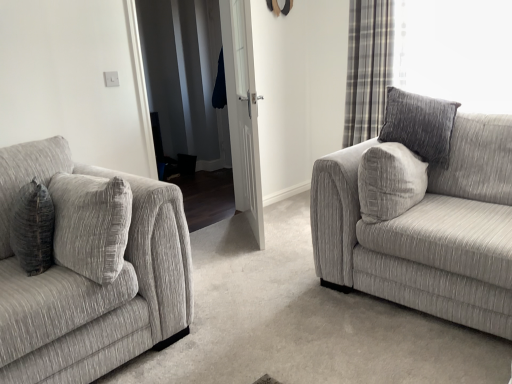
What do you see at coordinates (243, 111) in the screenshot?
I see `white glossy door at center` at bounding box center [243, 111].

Identify the location of plaid fabric curtain at upper right. The width and height of the screenshot is (512, 384). (367, 68).

The height and width of the screenshot is (384, 512). I want to click on textured gray couch at left, which is counted as the first studio couch, starting from the left, so click(x=90, y=269).

Is plaid fabric curtain at upper right taller or shorter than textured gray couch at right, which is counted as the first studio couch, starting from the right?

Clearly, plaid fabric curtain at upper right is taller compared to textured gray couch at right, which is counted as the first studio couch, starting from the right.

Is plaid fabric curtain at upper right smaller than textured gray couch at right, marked as the 2th studio couch in a left-to-right arrangement?

Yes, plaid fabric curtain at upper right is smaller than textured gray couch at right, marked as the 2th studio couch in a left-to-right arrangement.

From a real-world perspective, is plaid fabric curtain at upper right positioned under textured gray couch at right, marked as the 2th studio couch in a left-to-right arrangement, based on gravity?

No.

How many degrees apart are the facing directions of plaid fabric curtain at upper right and textured gray couch at right, marked as the 2th studio couch in a left-to-right arrangement?

They differ by 4.1 degrees in their facing directions.

Considering the relative positions of textured gray couch at left, acting as the 2th studio couch starting from the right, and white glossy door at center in the image provided, is textured gray couch at left, acting as the 2th studio couch starting from the right, to the right of white glossy door at center from the viewer's perspective?

In fact, textured gray couch at left, acting as the 2th studio couch starting from the right, is to the left of white glossy door at center.

Is white glossy door at center completely or partially inside textured gray couch at left, which is counted as the first studio couch, starting from the left?

Actually, white glossy door at center is outside textured gray couch at left, which is counted as the first studio couch, starting from the left.

Does textured gray couch at left, which is counted as the first studio couch, starting from the left, have a lesser height compared to white glossy door at center?

Correct, textured gray couch at left, which is counted as the first studio couch, starting from the left, is not as tall as white glossy door at center.

From a real-world perspective, which object rests below the other?

textured gray couch at right, which is counted as the first studio couch, starting from the right, from a real-world perspective.

Does textured gray couch at left, which is counted as the first studio couch, starting from the left, have a lesser height compared to textured gray couch at right, marked as the 2th studio couch in a left-to-right arrangement?

No, textured gray couch at left, which is counted as the first studio couch, starting from the left, is not shorter than textured gray couch at right, marked as the 2th studio couch in a left-to-right arrangement.

Could you tell me if textured gray couch at left, which is counted as the first studio couch, starting from the left, is facing textured gray couch at right, which is counted as the first studio couch, starting from the right?

No.

Which is in front, textured gray couch at left, acting as the 2th studio couch starting from the right, or textured gray couch at right, which is counted as the first studio couch, starting from the right?

textured gray couch at left, acting as the 2th studio couch starting from the right, is in front.

Is textured gray couch at right, which is counted as the first studio couch, starting from the right, in contact with plaid fabric curtain at upper right?

No, textured gray couch at right, which is counted as the first studio couch, starting from the right, is not in contact with plaid fabric curtain at upper right.

Does textured gray couch at right, marked as the 2th studio couch in a left-to-right arrangement, have a smaller size compared to plaid fabric curtain at upper right?

No, textured gray couch at right, marked as the 2th studio couch in a left-to-right arrangement, is not smaller than plaid fabric curtain at upper right.

From the image's perspective, which one is positioned lower, textured gray couch at right, which is counted as the first studio couch, starting from the right, or plaid fabric curtain at upper right?

textured gray couch at right, which is counted as the first studio couch, starting from the right, from the image's perspective.

Could you measure the distance between white glossy door at center and textured gray couch at right, which is counted as the first studio couch, starting from the right?

white glossy door at center is 1.08 meters away from textured gray couch at right, which is counted as the first studio couch, starting from the right.

Visually, is white glossy door at center positioned to the left or to the right of textured gray couch at right, which is counted as the first studio couch, starting from the right?

From the image, it's evident that white glossy door at center is to the left of textured gray couch at right, which is counted as the first studio couch, starting from the right.

I want to click on studio couch located on the right of white glossy door at center, so pos(422,213).

Can you confirm if white glossy door at center is thinner than textured gray couch at right, which is counted as the first studio couch, starting from the right?

Yes.

From the picture: Could you measure the distance between textured gray couch at right, marked as the 2th studio couch in a left-to-right arrangement, and white glossy door at center?

textured gray couch at right, marked as the 2th studio couch in a left-to-right arrangement, is 1.08 meters from white glossy door at center.

Is point (400, 112) in front of point (234, 97)?

Yes, it is in front of point (234, 97).

Is textured gray couch at right, which is counted as the first studio couch, starting from the right, turned away from white glossy door at center?

That's not correct — textured gray couch at right, which is counted as the first studio couch, starting from the right, is not looking away from white glossy door at center.

Consider the image. From a real-world perspective, is textured gray couch at right, which is counted as the first studio couch, starting from the right, physically located above or below white glossy door at center?

textured gray couch at right, which is counted as the first studio couch, starting from the right, is situated lower than white glossy door at center in the real world.

Would you say textured gray couch at right, marked as the 2th studio couch in a left-to-right arrangement, is outside textured gray couch at left, acting as the 2th studio couch starting from the right?

Indeed, textured gray couch at right, marked as the 2th studio couch in a left-to-right arrangement, is completely outside textured gray couch at left, acting as the 2th studio couch starting from the right.

From the image's perspective, which is below, textured gray couch at right, marked as the 2th studio couch in a left-to-right arrangement, or textured gray couch at left, acting as the 2th studio couch starting from the right?

From the image's view, textured gray couch at left, acting as the 2th studio couch starting from the right, is below.

Is textured gray couch at right, marked as the 2th studio couch in a left-to-right arrangement, smaller than textured gray couch at left, which is counted as the first studio couch, starting from the left?

No, textured gray couch at right, marked as the 2th studio couch in a left-to-right arrangement, is not smaller than textured gray couch at left, which is counted as the first studio couch, starting from the left.

From a real-world perspective, who is located lower, textured gray couch at right, marked as the 2th studio couch in a left-to-right arrangement, or textured gray couch at left, which is counted as the first studio couch, starting from the left?

In real-world perspective, textured gray couch at right, marked as the 2th studio couch in a left-to-right arrangement, is lower.

Locate an element on the screen. This screenshot has height=384, width=512. curtain above the textured gray couch at right, which is counted as the first studio couch, starting from the right (from the image's perspective) is located at coordinates (367, 68).

I want to click on screen door on the right of textured gray couch at left, which is counted as the first studio couch, starting from the left, so click(x=243, y=111).

Consider the image. From the image, which object appears to be farther from white glossy door at center, textured gray couch at right, marked as the 2th studio couch in a left-to-right arrangement, or plaid fabric curtain at upper right?

Based on the image, textured gray couch at right, marked as the 2th studio couch in a left-to-right arrangement, appears to be further to white glossy door at center.

In the scene shown: Looking at the image, which one is located further to textured gray couch at right, which is counted as the first studio couch, starting from the right, white glossy door at center or textured gray couch at left, which is counted as the first studio couch, starting from the left?

textured gray couch at left, which is counted as the first studio couch, starting from the left, is positioned further to the anchor textured gray couch at right, which is counted as the first studio couch, starting from the right.

Which object lies nearer to the anchor point plaid fabric curtain at upper right, textured gray couch at right, which is counted as the first studio couch, starting from the right, or textured gray couch at left, acting as the 2th studio couch starting from the right?

textured gray couch at right, which is counted as the first studio couch, starting from the right, is closer to plaid fabric curtain at upper right.

Considering their positions, is white glossy door at center positioned further to textured gray couch at left, which is counted as the first studio couch, starting from the left, than textured gray couch at right, marked as the 2th studio couch in a left-to-right arrangement?

Based on the image, white glossy door at center appears to be further to textured gray couch at left, which is counted as the first studio couch, starting from the left.

Estimate the real-world distances between objects in this image. Which object is further from textured gray couch at left, which is counted as the first studio couch, starting from the left, plaid fabric curtain at upper right or white glossy door at center?

plaid fabric curtain at upper right lies further to textured gray couch at left, which is counted as the first studio couch, starting from the left, than the other object.

Considering their positions, is textured gray couch at left, acting as the 2th studio couch starting from the right, positioned closer to plaid fabric curtain at upper right than white glossy door at center?

white glossy door at center is closer to plaid fabric curtain at upper right.

From the image, which object appears to be farther from textured gray couch at right, which is counted as the first studio couch, starting from the right, plaid fabric curtain at upper right or textured gray couch at left, acting as the 2th studio couch starting from the right?

Among the two, plaid fabric curtain at upper right is located further to textured gray couch at right, which is counted as the first studio couch, starting from the right.

From the image, which object appears to be farther from textured gray couch at right, marked as the 2th studio couch in a left-to-right arrangement, plaid fabric curtain at upper right or white glossy door at center?

plaid fabric curtain at upper right is further to textured gray couch at right, marked as the 2th studio couch in a left-to-right arrangement.

Locate an element on the screen. screen door situated between textured gray couch at left, which is counted as the first studio couch, starting from the left, and textured gray couch at right, which is counted as the first studio couch, starting from the right, from left to right is located at coordinates (243, 111).

At what (x,y) coordinates should I click in order to perform the action: click on screen door between textured gray couch at left, acting as the 2th studio couch starting from the right, and plaid fabric curtain at upper right from front to back. Please return your answer as a coordinate pair (x, y). Image resolution: width=512 pixels, height=384 pixels. Looking at the image, I should click on (243, 111).

The height and width of the screenshot is (384, 512). Identify the location of curtain located between textured gray couch at left, which is counted as the first studio couch, starting from the left, and textured gray couch at right, which is counted as the first studio couch, starting from the right, in the left-right direction. (367, 68).

Identify the location of screen door between textured gray couch at right, marked as the 2th studio couch in a left-to-right arrangement, and plaid fabric curtain at upper right in the front-back direction. (243, 111).